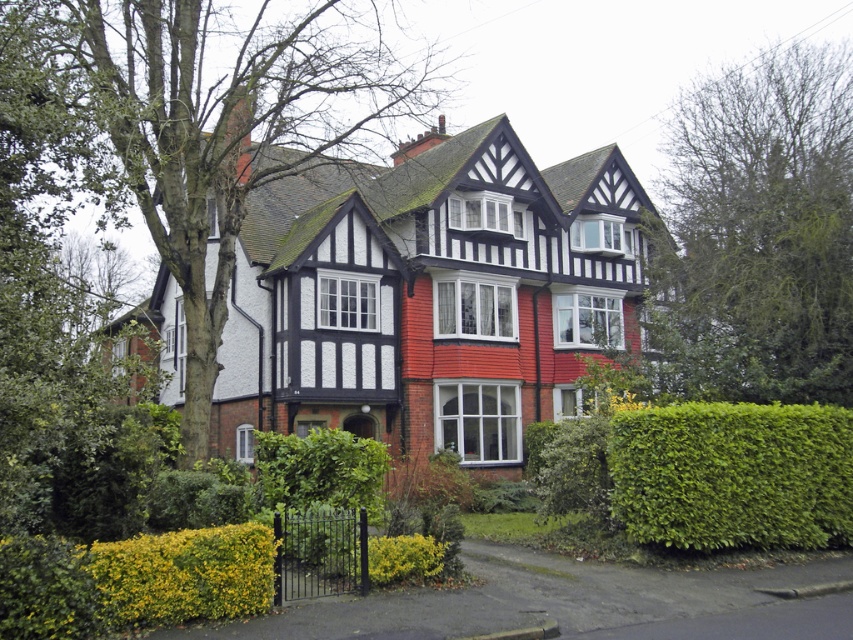
Does green leafy tree at left appear under green leafy hedge at center?

Incorrect, green leafy tree at left is not positioned below green leafy hedge at center.

Who is positioned more to the right, green leafy tree at left or green leafy hedge at center?

From the viewer's perspective, green leafy hedge at center appears more on the right side.

Locate an element on the screen. green leafy tree at left is located at coordinates [206, 122].

The image size is (853, 640). What are the coordinates of `green leafy tree at left` in the screenshot? It's located at (206, 122).

Is green leafy tree at left bigger than green leafy hedge at lower right?

Yes.

Is point (430, 102) closer to camera compared to point (676, 525)?

No.

This screenshot has width=853, height=640. Identify the location of green leafy tree at left. (206, 122).

Can you confirm if green leafy tree at upper right is thinner than green leafy hedge at center?

Incorrect, green leafy tree at upper right's width is not less than green leafy hedge at center's.

Is point (718, 129) positioned after point (306, 456)?

Yes, it is.

Is point (756, 216) closer to viewer compared to point (325, 461)?

No, it is not.

Where is `green leafy tree at upper right`? The image size is (853, 640). green leafy tree at upper right is located at coordinates (757, 236).